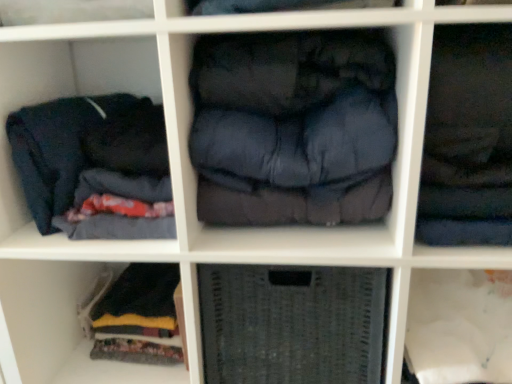
Question: Does dark blue fabric at upper right, the first clothing from the right, have a lesser width compared to dark blue fabric at left, the 3th clothing in the right-to-left sequence?

Choices:
 (A) yes
 (B) no

Answer: (A)

Question: Does dark blue fabric at upper right, the first clothing from the right, have a greater width compared to dark blue fabric at left, the 3th clothing in the right-to-left sequence?

Choices:
 (A) no
 (B) yes

Answer: (A)

Question: Considering the relative positions of dark blue fabric at upper right, which is counted as the third clothing, starting from the left, and dark blue fabric at left, the 3th clothing in the right-to-left sequence, in the image provided, is dark blue fabric at upper right, which is counted as the third clothing, starting from the left, to the right of dark blue fabric at left, the 3th clothing in the right-to-left sequence, from the viewer's perspective?

Choices:
 (A) yes
 (B) no

Answer: (A)

Question: Is dark blue fabric at upper right, the first clothing from the right, oriented towards dark blue fabric at left, which is the 1th clothing in left-to-right order?

Choices:
 (A) no
 (B) yes

Answer: (A)

Question: Is dark blue fabric at upper right, which is counted as the third clothing, starting from the left, to the left of dark blue fabric at left, which is the 1th clothing in left-to-right order, from the viewer's perspective?

Choices:
 (A) no
 (B) yes

Answer: (A)

Question: Is dark blue fabric at upper right, which is counted as the third clothing, starting from the left, looking in the opposite direction of dark blue fabric at left, which is the 1th clothing in left-to-right order?

Choices:
 (A) no
 (B) yes

Answer: (A)

Question: Does gray woven basket at center have a greater width compared to dark blue quilted jacket at center, which is counted as the second clothing, starting from the left?

Choices:
 (A) no
 (B) yes

Answer: (A)

Question: Is gray woven basket at center looking in the opposite direction of dark blue quilted jacket at center, which is counted as the second clothing, starting from the left?

Choices:
 (A) yes
 (B) no

Answer: (B)

Question: Does gray woven basket at center come in front of dark blue quilted jacket at center, the second clothing viewed from the right?

Choices:
 (A) yes
 (B) no

Answer: (B)

Question: Is gray woven basket at center bigger than dark blue quilted jacket at center, which is counted as the second clothing, starting from the left?

Choices:
 (A) no
 (B) yes

Answer: (A)

Question: Can you confirm if gray woven basket at center is positioned to the left of dark blue quilted jacket at center, which is counted as the second clothing, starting from the left?

Choices:
 (A) yes
 (B) no

Answer: (B)

Question: Are gray woven basket at center and dark blue quilted jacket at center, the second clothing viewed from the right, far apart?

Choices:
 (A) yes
 (B) no

Answer: (B)

Question: Can you confirm if dark blue fabric at upper right, which is counted as the third clothing, starting from the left, is thinner than dark blue quilted jacket at center, the second clothing viewed from the right?

Choices:
 (A) yes
 (B) no

Answer: (B)